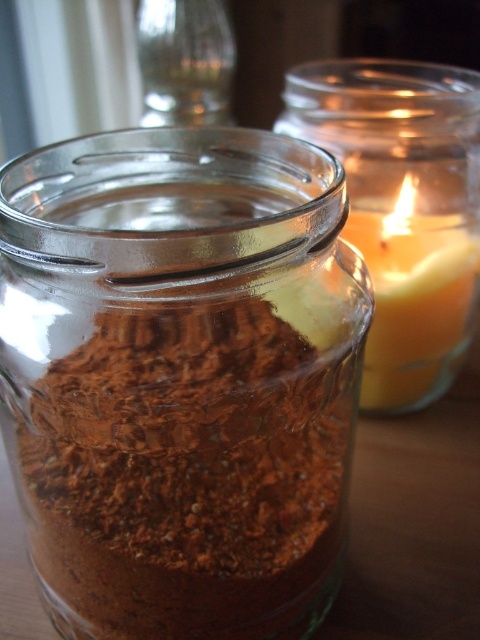
Question: Does transparent glass jar at center appear over yellow wax candle at right?

Choices:
 (A) no
 (B) yes

Answer: (A)

Question: Which object is positioned closest to the yellow wax candle at right?

Choices:
 (A) transparent glass jar at center
 (B) transparent glass jar at upper center

Answer: (A)

Question: Estimate the real-world distances between objects in this image. Which object is farther from the transparent glass jar at center?

Choices:
 (A) yellow wax candle at right
 (B) transparent glass jar at upper center

Answer: (B)

Question: Where is transparent glass jar at center located in relation to transparent glass jar at upper center in the image?

Choices:
 (A) above
 (B) below

Answer: (B)

Question: Based on their relative distances, which object is farther from the transparent glass jar at center?

Choices:
 (A) yellow wax candle at right
 (B) transparent glass jar at upper center

Answer: (B)

Question: Is yellow wax candle at right positioned behind transparent glass jar at upper center?

Choices:
 (A) no
 (B) yes

Answer: (A)